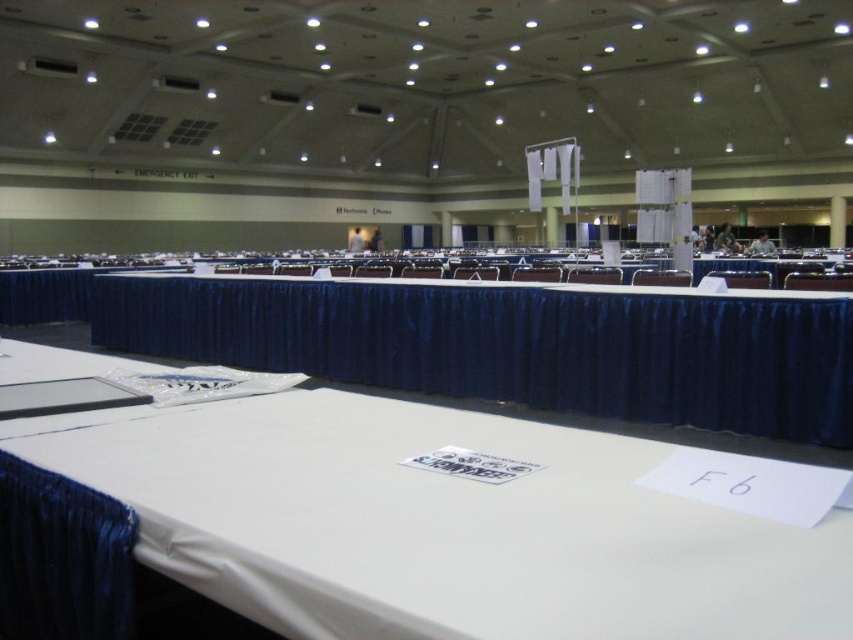
You are organizing a conference and need to ensure that the matte black chair at center is placed correctly on the white fabric tablecloth at center. Is the chair currently positioned over the tablecloth?

The white fabric tablecloth at center is positioned under the matte black chair at center, so yes, the chair is correctly placed over the tablecloth.